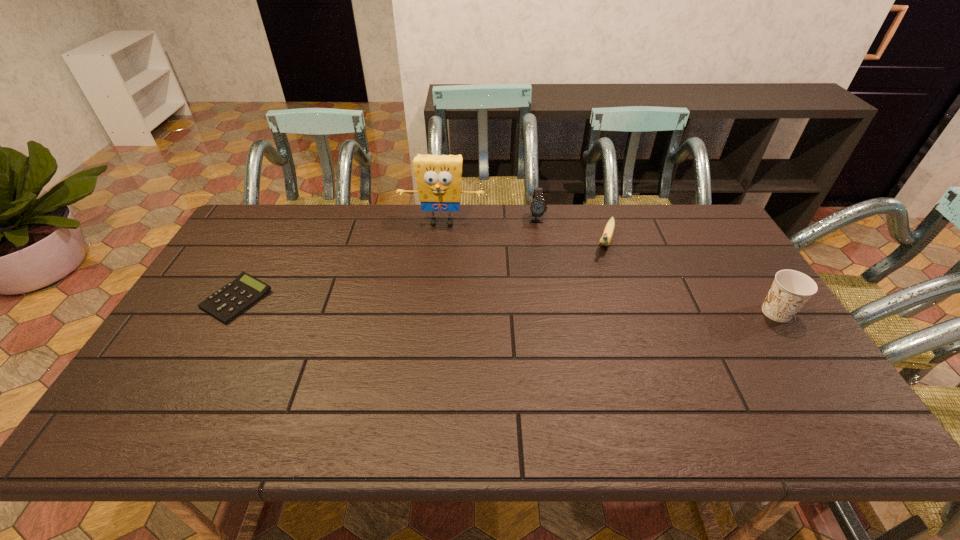
At what (x,y) coordinates should I click in order to perform the action: click on free space between the rightmost object and the third object from left to right. Please return your answer as a coordinate pair (x, y). Looking at the image, I should click on (656, 266).

The height and width of the screenshot is (540, 960). I want to click on vacant area that lies between the tallest object and the fourth tallest object, so click(524, 232).

The width and height of the screenshot is (960, 540). In order to click on blank region between the banana and the calculator in this screenshot , I will do `click(421, 271)`.

The width and height of the screenshot is (960, 540). What are the coordinates of `blank region between the third object from left to right and the fourth object from left to right` in the screenshot? It's located at (570, 231).

Locate an element on the screen. This screenshot has width=960, height=540. vacant point located between the Dixie cup and the calculator is located at coordinates (506, 306).

You are a GUI agent. You are given a task and a screenshot of the screen. Output one action in this format:
    pyautogui.click(x=<x>, y=<y>)
    Task: Click on the vacant space that's between the fourth tallest object and the leftmost object
    This screenshot has height=540, width=960.
    Given the screenshot: What is the action you would take?
    pyautogui.click(x=421, y=271)

Where is `free space between the rightmost object and the fourth object from left to right`? The height and width of the screenshot is (540, 960). free space between the rightmost object and the fourth object from left to right is located at coordinates (691, 278).

I want to click on free space between the third object from left to right and the banana, so click(570, 231).

Find the location of `object identified as the fourth closest to the watch`. object identified as the fourth closest to the watch is located at coordinates (227, 303).

The height and width of the screenshot is (540, 960). Find the location of `object that stands as the fourth closest to the watch`. object that stands as the fourth closest to the watch is located at coordinates (227, 303).